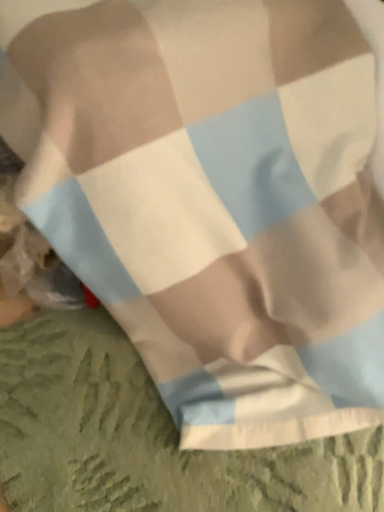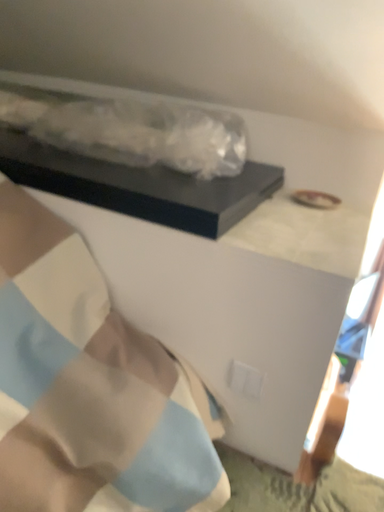
Question: How did the camera likely rotate when shooting the video?

Choices:
 (A) rotated left
 (B) rotated right

Answer: (B)